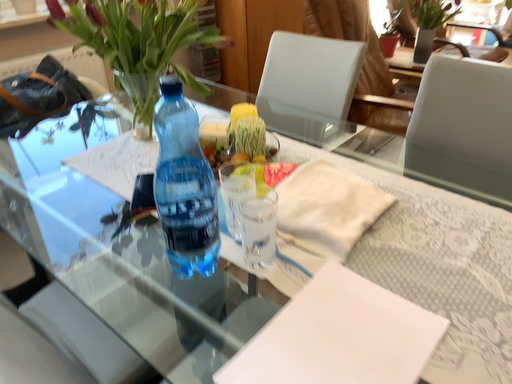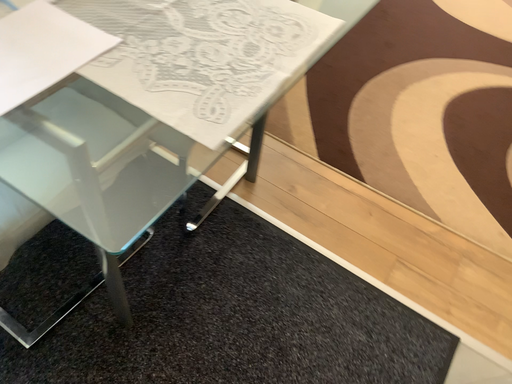
Question: Which way did the camera rotate in the video?

Choices:
 (A) rotated upward
 (B) rotated downward

Answer: (B)